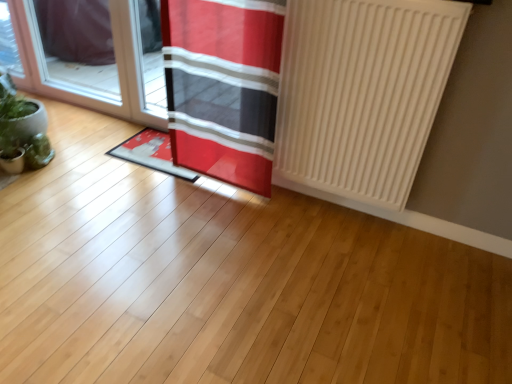
Image resolution: width=512 pixels, height=384 pixels. In order to click on vacant space in between green matte plant at left and white matte radiator at right in this screenshot , I will do coord(145,192).